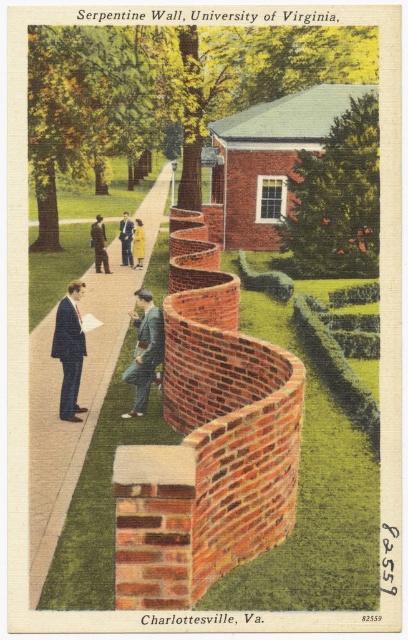
You are attending a historical event at the University of Virginia and notice two people in the scene described. One is wearing a dark brown suit at center and the other a yellow fabric dress at center. From your perspective, which person is standing lower in the image?

The dark brown suit at center is below the yellow fabric dress at center, so the person in the dark brown suit at center is standing lower in the image.

You are attending a historical event at the University of Virginia and notice two people in the scene. One is wearing a dark brown suit at center and the other a yellow fabric dress at center. From your perspective, which person is standing to the left of the other?

The dark brown suit at center is to the left of the yellow fabric dress at center.